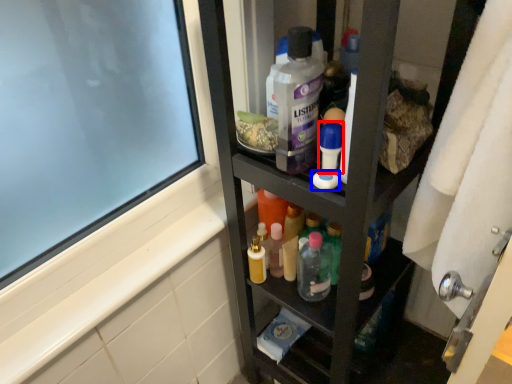
Question: Which of the following is the closest to the observer, toiletry (highlighted by a red box) or soap (highlighted by a blue box)?

Choices:
 (A) toiletry
 (B) soap

Answer: (A)